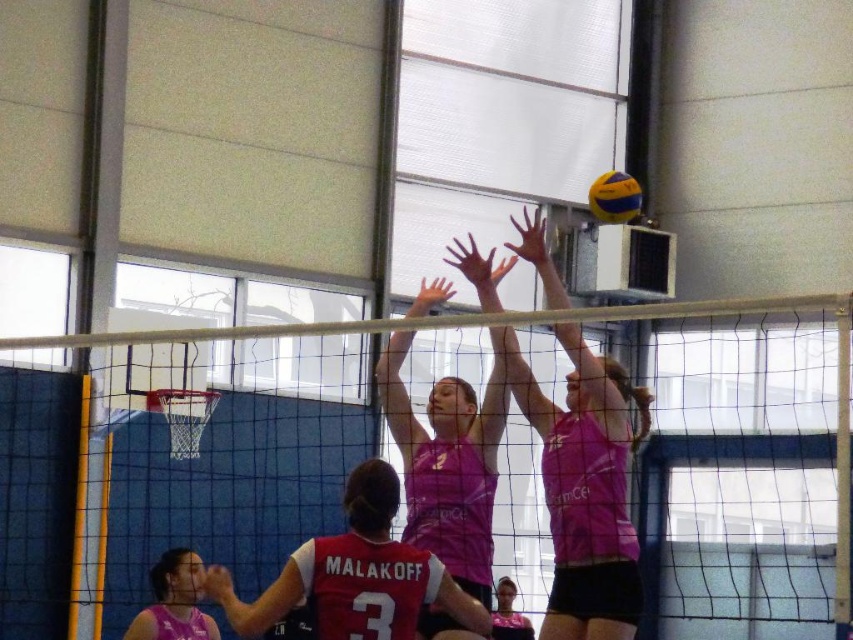
Is white mesh net at center smaller than pink fabric shirt at upper center?

No.

Measure the distance from white mesh net at center to pink fabric shirt at upper center.

white mesh net at center is 4.33 meters away from pink fabric shirt at upper center.

Is point (778, 598) positioned in front of point (581, 468)?

That is False.

This screenshot has height=640, width=853. What are the coordinates of `white mesh net at center` in the screenshot? It's located at (399, 460).

Does pink fabric shirt at upper center appear on the right side of pink fabric jersey at center?

Correct, you'll find pink fabric shirt at upper center to the right of pink fabric jersey at center.

Measure the distance between pink fabric shirt at upper center and pink fabric jersey at center.

The distance of pink fabric shirt at upper center from pink fabric jersey at center is 3.39 meters.

You are a GUI agent. You are given a task and a screenshot of the screen. Output one action in this format:
    pyautogui.click(x=<x>, y=<y>)
    Task: Click on the pink fabric shirt at upper center
    This screenshot has height=640, width=853.
    Given the screenshot: What is the action you would take?
    pyautogui.click(x=584, y=486)

Image resolution: width=853 pixels, height=640 pixels. What are the coordinates of `pink fabric shirt at upper center` in the screenshot? It's located at (584, 486).

What do you see at coordinates (399, 460) in the screenshot? I see `white mesh net at center` at bounding box center [399, 460].

Can you confirm if white mesh net at center is positioned to the left of pink fabric jersey at center?

Incorrect, white mesh net at center is not on the left side of pink fabric jersey at center.

Find the location of a particular element. The height and width of the screenshot is (640, 853). white mesh net at center is located at coordinates (399, 460).

You are a GUI agent. You are given a task and a screenshot of the screen. Output one action in this format:
    pyautogui.click(x=<x>, y=<y>)
    Task: Click on the white mesh net at center
    
    Given the screenshot: What is the action you would take?
    pyautogui.click(x=399, y=460)